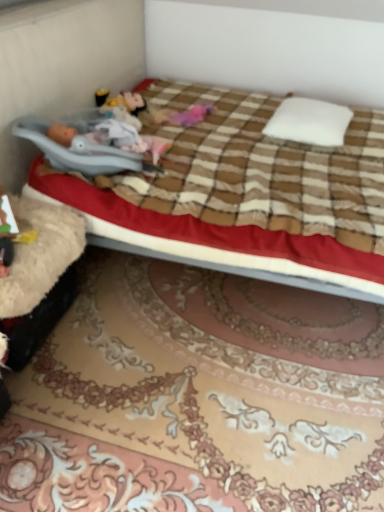
Question: From the image's perspective, is pink fabric doll at center over brown plaid blanket at center?

Choices:
 (A) yes
 (B) no

Answer: (A)

Question: Is pink fabric doll at center thinner than brown plaid blanket at center?

Choices:
 (A) no
 (B) yes

Answer: (B)

Question: Is pink fabric doll at center behind brown plaid blanket at center?

Choices:
 (A) yes
 (B) no

Answer: (A)

Question: From the image's perspective, does pink fabric doll at center appear lower than brown plaid blanket at center?

Choices:
 (A) yes
 (B) no

Answer: (B)

Question: From a real-world perspective, does pink fabric doll at center sit lower than brown plaid blanket at center?

Choices:
 (A) no
 (B) yes

Answer: (A)

Question: Based on their sizes in the image, would you say pink fabric doll at center is bigger or smaller than brown plaid blanket at center?

Choices:
 (A) small
 (B) big

Answer: (A)

Question: Is point (175, 113) positioned closer to the camera than point (180, 201)?

Choices:
 (A) farther
 (B) closer

Answer: (A)

Question: From a real-world perspective, is pink fabric doll at center physically located above or below brown plaid blanket at center?

Choices:
 (A) above
 (B) below

Answer: (A)

Question: Is pink fabric doll at center in front of or behind brown plaid blanket at center in the image?

Choices:
 (A) front
 (B) behind

Answer: (B)

Question: Looking at the image, does white soft pillow at center seem bigger or smaller compared to brown plaid blanket at center?

Choices:
 (A) small
 (B) big

Answer: (A)

Question: Considering the positions of point (329, 134) and point (263, 153), is point (329, 134) closer or farther from the camera than point (263, 153)?

Choices:
 (A) farther
 (B) closer

Answer: (A)

Question: In the image, is white soft pillow at center positioned in front of or behind brown plaid blanket at center?

Choices:
 (A) behind
 (B) front

Answer: (A)

Question: In the image, is white soft pillow at center on the left side or the right side of brown plaid blanket at center?

Choices:
 (A) right
 (B) left

Answer: (A)

Question: Would you say white soft pillow at center is to the left or to the right of pink fabric doll at center in the picture?

Choices:
 (A) right
 (B) left

Answer: (A)

Question: Relative to pink fabric doll at center, is white soft pillow at center in front or behind?

Choices:
 (A) front
 (B) behind

Answer: (A)